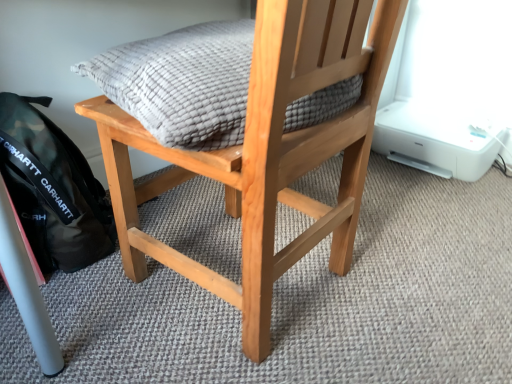
Identify the location of free space in front of black matte backpack at lower left. (83, 312).